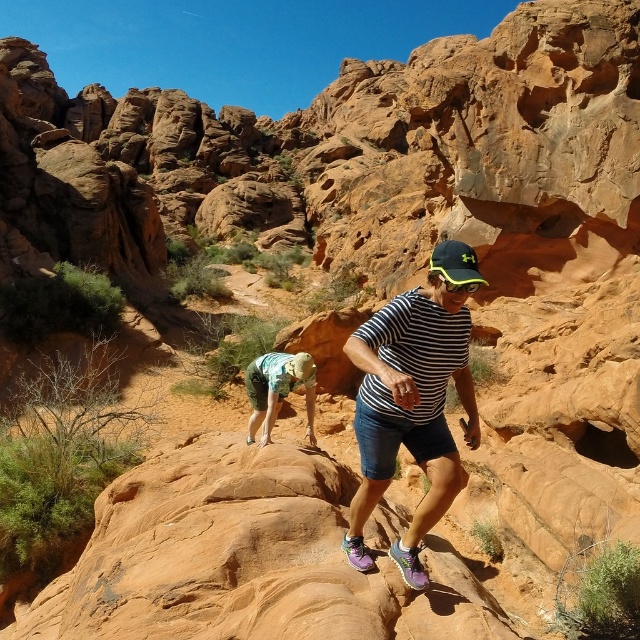
You are a photographer trying to capture a closeup shot of the striped cotton shirt at center and the green camouflage shorts at center. Given that your camera has a fixed focus range that can only clearly capture objects within a 20cm diameter area, will both items fit within the frame if they are positioned side by side?

The striped cotton shirt at center is larger in size than green camouflage shorts at center. Since the camera can only capture a 20cm diameter area, and the shirt is larger, it is possible that both items may not fit within the frame when placed side by side, depending on their combined size.

You are a drone operator trying to capture aerial footage of two specific points in the desert scene. The first point is labeled as point (305, 365) and the second as point (445, 252). Since you want to ensure your drone can navigate safely between them, which point is closer to the camera so you can adjust your flight path accordingly?

Point (445, 252) is closer to the camera than point (305, 365), so you should adjust your flight path to account for its proximity.

You are a hiker trying to decide which item to pack first between the green camouflage shorts at center and the black matte baseball cap at center. Based on their sizes, which one should you prioritize packing if you want to save space?

The green camouflage shorts at center is not as tall as the black matte baseball cap at center, so you should prioritize packing the black matte baseball cap at center first to save space.